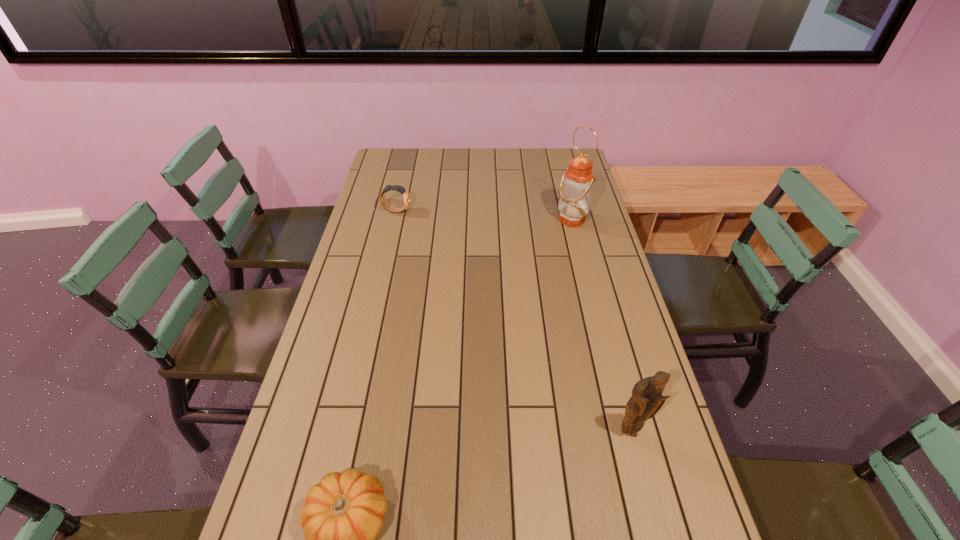
Where is `free region at the far edge of the desktop`? The height and width of the screenshot is (540, 960). free region at the far edge of the desktop is located at coordinates (528, 171).

Image resolution: width=960 pixels, height=540 pixels. Find the location of `vacant space at the left edge of the desktop`. vacant space at the left edge of the desktop is located at coordinates (379, 272).

In the image, there is a desktop. Identify the location of vacant space at the right edge. This screenshot has height=540, width=960. (643, 517).

The image size is (960, 540). Identify the location of empty space that is in between the figurine and the oil lamp. (601, 326).

This screenshot has width=960, height=540. Identify the location of empty location between the third farthest object and the oil lamp. coord(601,326).

Where is `empty space that is in between the figurine and the tallest object`? Image resolution: width=960 pixels, height=540 pixels. empty space that is in between the figurine and the tallest object is located at coordinates (601, 326).

Where is `vacant space in between the third farthest object and the oil lamp`? The width and height of the screenshot is (960, 540). vacant space in between the third farthest object and the oil lamp is located at coordinates (601, 326).

Find the location of a particular element. This screenshot has width=960, height=540. empty space that is in between the watch and the oil lamp is located at coordinates click(x=484, y=215).

The width and height of the screenshot is (960, 540). Identify the location of object identified as the second closest to the watch. (342, 515).

Locate an element on the screen. object that ranks as the closest to the watch is located at coordinates click(576, 187).